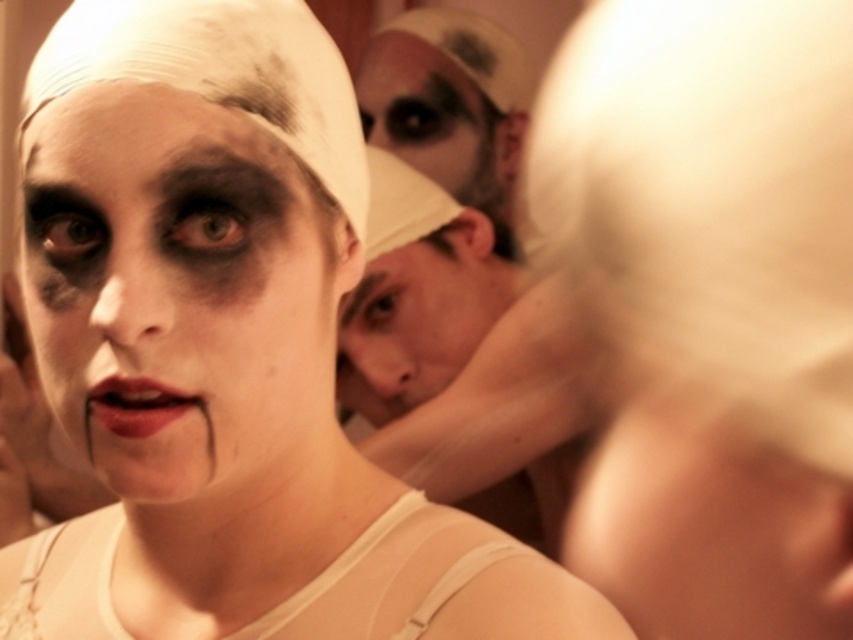
Can you confirm if smooth skin face at center is positioned below black matte eyebrow at upper center?

Yes, smooth skin face at center is below black matte eyebrow at upper center.

Is smooth skin face at center bigger than black matte eyebrow at upper center?

Indeed, smooth skin face at center has a larger size compared to black matte eyebrow at upper center.

Between point (358, 326) and point (479, 125), which one is positioned behind?

Positioned behind is point (479, 125).

You are a GUI agent. You are given a task and a screenshot of the screen. Output one action in this format:
    pyautogui.click(x=<x>, y=<y>)
    Task: Click on the smooth skin face at center
    The height and width of the screenshot is (640, 853).
    Given the screenshot: What is the action you would take?
    pyautogui.click(x=419, y=317)

Looking at this image, can you confirm if smooth beige cap at center is positioned to the right of matte white face at upper center?

Indeed, smooth beige cap at center is positioned on the right side of matte white face at upper center.

Between point (527, 378) and point (500, 120), which one is positioned in front?

Positioned in front is point (527, 378).

Find the location of `smooth beige cap at center`. smooth beige cap at center is located at coordinates (456, 346).

At what (x,y) coordinates should I click in order to perform the action: click on matte white face at upper center. Please return your answer as a coordinate pair (x, y). The height and width of the screenshot is (640, 853). Looking at the image, I should click on (436, 118).

In the scene shown: Is matte white face at upper center wider than matte red lipstick at center?

Yes, matte white face at upper center is wider than matte red lipstick at center.

Is point (506, 168) less distant than point (126, 387)?

No, (506, 168) is behind (126, 387).

At what (x,y) coordinates should I click in order to perform the action: click on matte white face at upper center. Please return your answer as a coordinate pair (x, y). Looking at the image, I should click on pos(436,118).